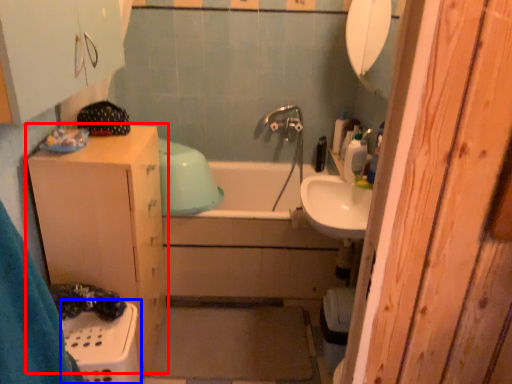
Question: Which object is closer to the camera taking this photo, bathroom cabinet (highlighted by a red box) or laundry basket (highlighted by a blue box)?

Choices:
 (A) bathroom cabinet
 (B) laundry basket

Answer: (B)